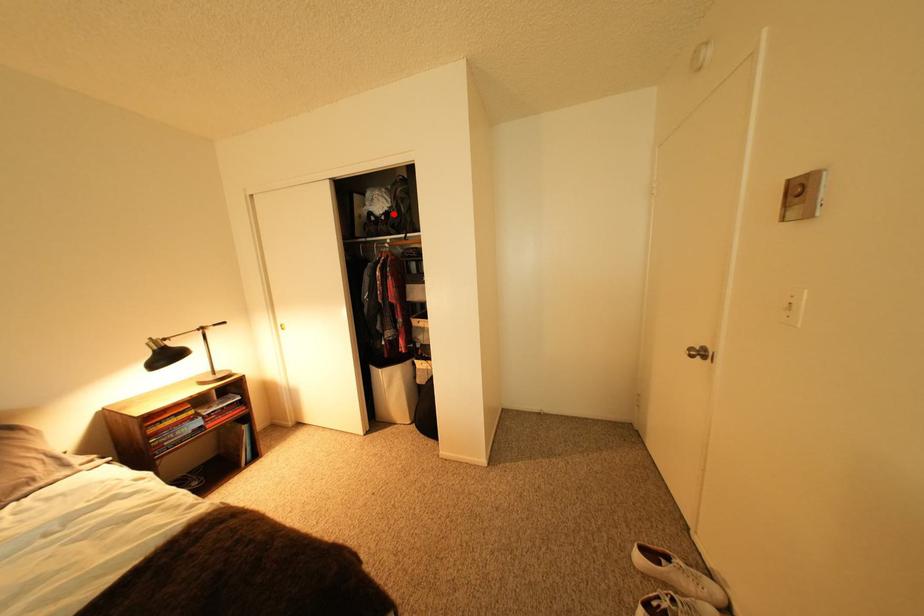
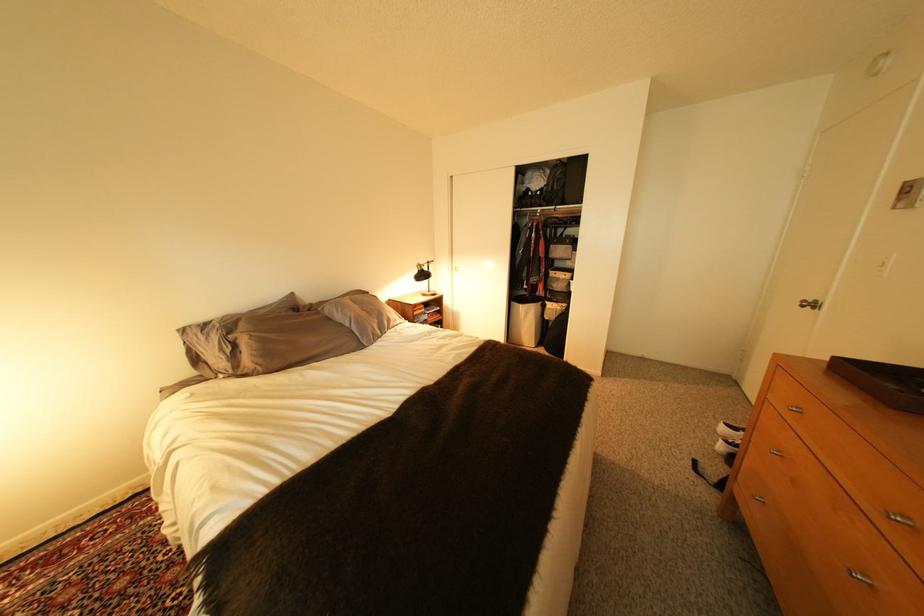
Locate, in the second image, the point that corresponds to the highlighted location in the first image.

(550, 191)